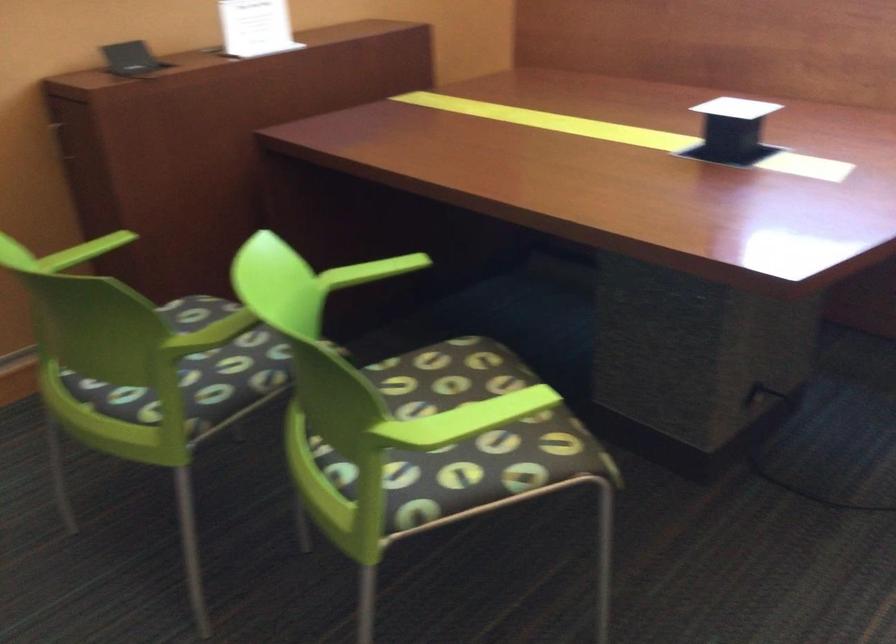
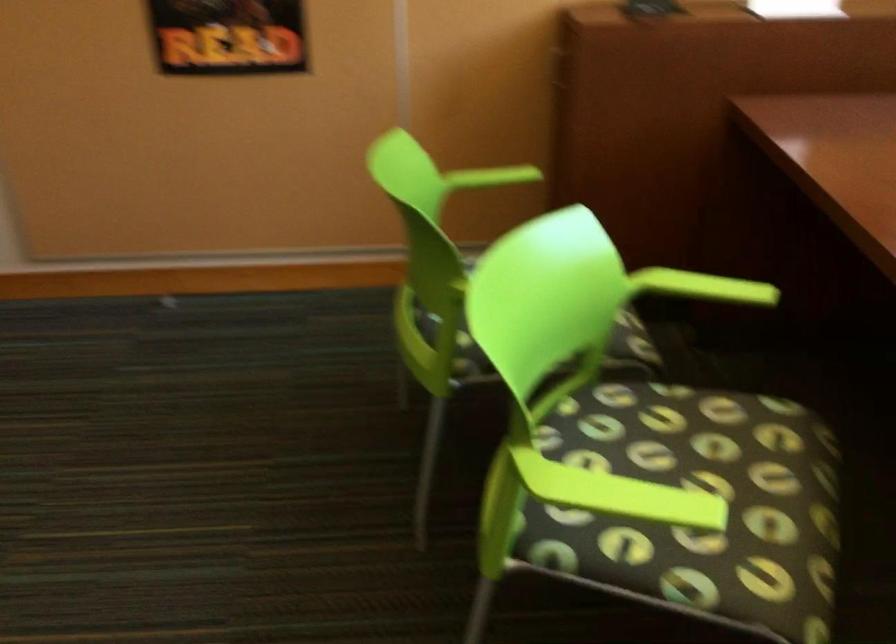
The point at (x=484, y=410) is marked in the first image. Where is the corresponding point in the second image?

(619, 494)